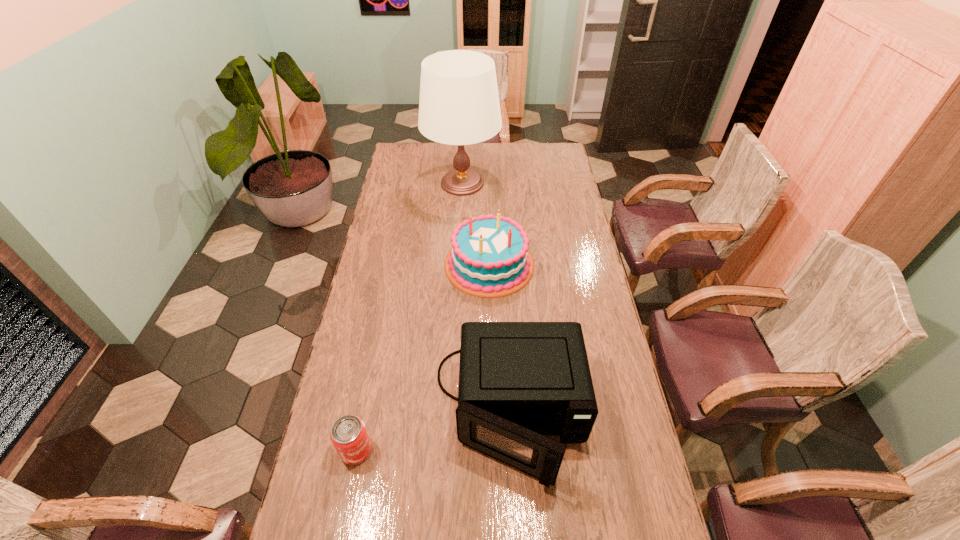
The image size is (960, 540). What are the coordinates of `object that stands as the third closest to the shortest object` in the screenshot? It's located at pos(459,104).

Identify the location of the third closest object to the leftmost object. The height and width of the screenshot is (540, 960). (459, 104).